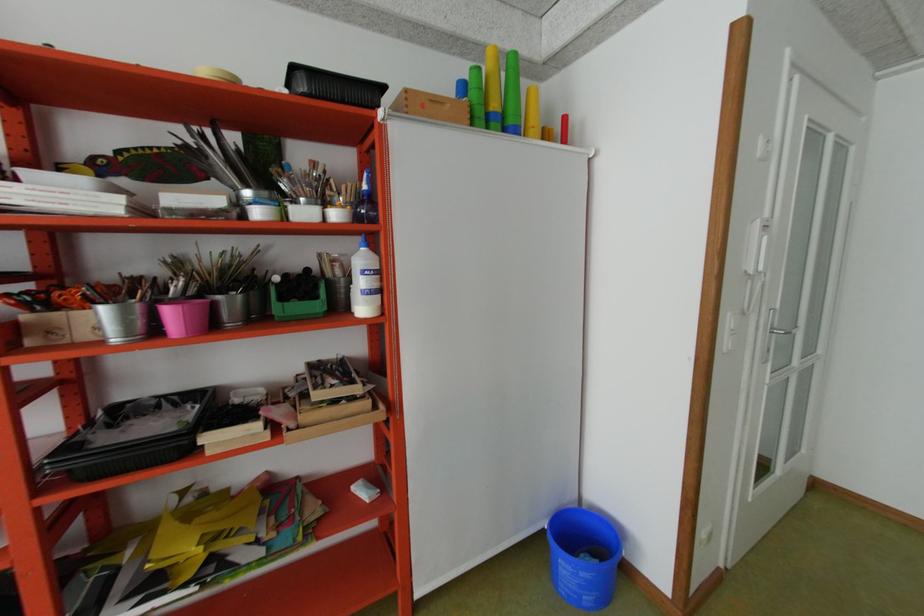
The image size is (924, 616). I want to click on green plastic cylinder, so click(x=298, y=302).